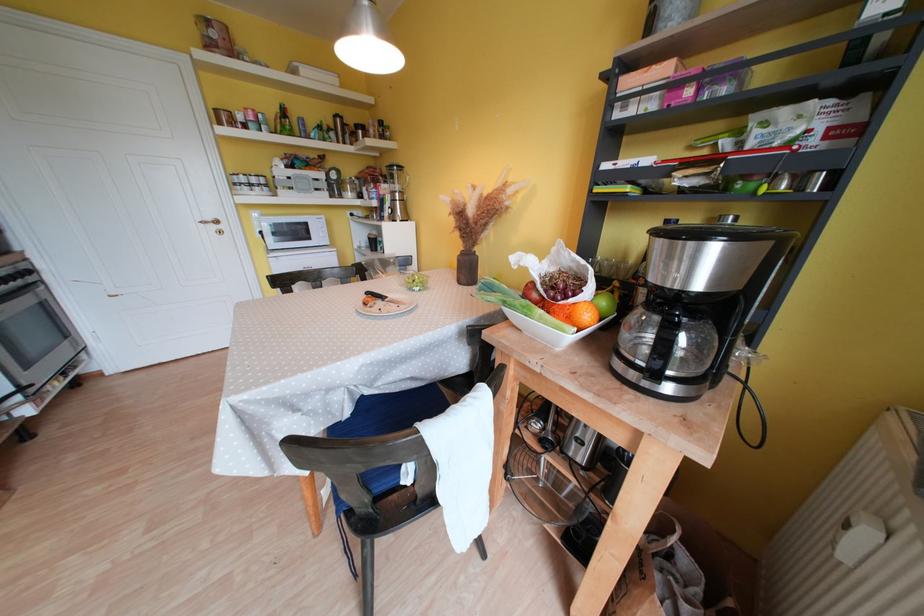
Find where to lift the white fruit bowl. Please return your answer as a coordinate pair (x, y).

(548, 330)